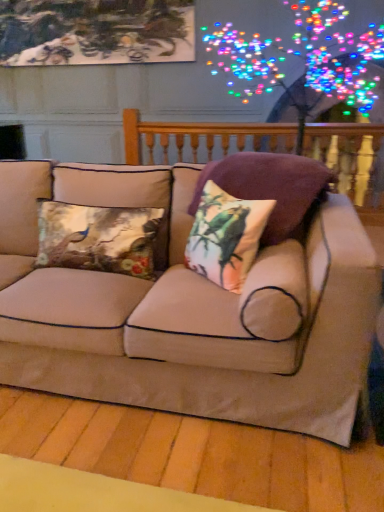
What do you see at coordinates (99, 238) in the screenshot? I see `metallic floral cushion at center left, acting as the first pillow starting from the left` at bounding box center [99, 238].

Locate an element on the screen. wooden balustrade at upper center is located at coordinates (199, 140).

Find the location of a particular element. The image size is (384, 512). velvet floral pillow at center, placed as the third pillow when sorted from left to right is located at coordinates (271, 189).

You are a GUI agent. You are given a task and a screenshot of the screen. Output one action in this format:
    pyautogui.click(x=<x>, y=<y>)
    Task: Click on the studio couch below the metallic floral cushion at center left, acting as the third pillow starting from the right (from a real-world perspective)
    The width and height of the screenshot is (384, 512).
    Given the screenshot: What is the action you would take?
    pyautogui.click(x=192, y=313)

Based on the photo, how many degrees apart are the facing directions of metallic floral cushion at center left, acting as the third pillow starting from the right, and beige fabric couch at center?

metallic floral cushion at center left, acting as the third pillow starting from the right, and beige fabric couch at center are facing 0.000838 degrees away from each other.

Which is nearer, (143, 214) or (285, 425)?

The point (285, 425) is more forward.

From the image's perspective, is metallic floral cushion at center left, acting as the third pillow starting from the right, located above or below beige fabric couch at center?

Based on their image positions, metallic floral cushion at center left, acting as the third pillow starting from the right, is located above beige fabric couch at center.

Does wooden balustrade at upper center have a greater height compared to beige fabric couch at center?

Indeed, wooden balustrade at upper center has a greater height compared to beige fabric couch at center.

From a real-world perspective, is wooden balustrade at upper center physically below beige fabric couch at center?

Incorrect, from a real-world perspective, wooden balustrade at upper center is higher than beige fabric couch at center.

Considering the points (316, 124) and (329, 393), which point is in front, point (316, 124) or point (329, 393)?

The point (329, 393) is more forward.

Does wooden balustrade at upper center have a larger size compared to beige fabric couch at center?

No, wooden balustrade at upper center is not bigger than beige fabric couch at center.

Considering the sizes of objects printed fabric cushion at center, which is the second pillow in right-to-left order, and beige fabric couch at center in the image provided, who is bigger, printed fabric cushion at center, which is the second pillow in right-to-left order, or beige fabric couch at center?

With larger size is beige fabric couch at center.

From the picture: Measure the distance between printed fabric cushion at center, which is the second pillow in right-to-left order, and beige fabric couch at center.

The distance of printed fabric cushion at center, which is the second pillow in right-to-left order, from beige fabric couch at center is 11.91 inches.

From a real-world perspective, is printed fabric cushion at center, which is the second pillow in right-to-left order, physically below beige fabric couch at center?

Incorrect, from a real-world perspective, printed fabric cushion at center, which is the second pillow in right-to-left order, is higher than beige fabric couch at center.

Is beige fabric couch at center inside printed fabric cushion at center, which is the second pillow in right-to-left order?

No, printed fabric cushion at center, which is the second pillow in right-to-left order, does not contain beige fabric couch at center.

Looking at the image, does velvet floral pillow at center, the 1th pillow when ordered from right to left, seem bigger or smaller compared to beige fabric couch at center?

In the image, velvet floral pillow at center, the 1th pillow when ordered from right to left, appears to be smaller than beige fabric couch at center.

Is point (239, 188) closer or farther from the camera than point (18, 338)?

Point (239, 188) appears to be farther away from the viewer than point (18, 338).

Between velvet floral pillow at center, the 1th pillow when ordered from right to left, and beige fabric couch at center, which one has smaller width?

With smaller width is velvet floral pillow at center, the 1th pillow when ordered from right to left.

From a real-world perspective, is velvet floral pillow at center, the 1th pillow when ordered from right to left, positioned above or below beige fabric couch at center?

Clearly, from a real-world perspective, velvet floral pillow at center, the 1th pillow when ordered from right to left, is above beige fabric couch at center.

From a real-world perspective, starting from the velvet floral pillow at center, placed as the third pillow when sorted from left to right, which pillow is the 1st one below it? Please provide its 2D coordinates.

[(226, 236)]

Could you tell me if printed fabric cushion at center, acting as the second pillow starting from the left, is turned towards velvet floral pillow at center, placed as the third pillow when sorted from left to right?

No.

Which object is further away from the camera taking this photo, printed fabric cushion at center, which is the second pillow in right-to-left order, or velvet floral pillow at center, placed as the third pillow when sorted from left to right?

velvet floral pillow at center, placed as the third pillow when sorted from left to right, is behind.

From the image's perspective, between printed fabric cushion at center, acting as the second pillow starting from the left, and velvet floral pillow at center, the 1th pillow when ordered from right to left, which one is located above?

velvet floral pillow at center, the 1th pillow when ordered from right to left, is shown above in the image.

Which point is more distant from viewer, [43,330] or [293,148]?

The point [293,148] is behind.

From a real-world perspective, is beige fabric couch at center located higher than wooden balustrade at upper center?

Actually, beige fabric couch at center is physically below wooden balustrade at upper center in the real world.

In terms of width, does beige fabric couch at center look wider or thinner when compared to wooden balustrade at upper center?

beige fabric couch at center is wider than wooden balustrade at upper center.

Can you confirm if beige fabric couch at center is positioned to the left of wooden balustrade at upper center?

Yes, beige fabric couch at center is to the left of wooden balustrade at upper center.

Which point is more distant from viewer, (35, 267) or (261, 145)?

The point (261, 145) is more distant.

Is wooden balustrade at upper center completely or partially inside metallic floral cushion at center left, acting as the third pillow starting from the right?

Definitely not — wooden balustrade at upper center is not inside metallic floral cushion at center left, acting as the third pillow starting from the right.

Looking at the image, does metallic floral cushion at center left, acting as the third pillow starting from the right, seem bigger or smaller compared to wooden balustrade at upper center?

In the image, metallic floral cushion at center left, acting as the third pillow starting from the right, appears to be smaller than wooden balustrade at upper center.

The image size is (384, 512). I want to click on studio couch lying in front of the metallic floral cushion at center left, acting as the first pillow starting from the left, so click(192, 313).

Where is `balustrade above the beige fabric couch at center (from the image's perspective)`? The width and height of the screenshot is (384, 512). balustrade above the beige fabric couch at center (from the image's perspective) is located at coordinates (199, 140).

Which object lies nearer to the anchor point printed fabric cushion at center, which is the second pillow in right-to-left order, velvet floral pillow at center, the 1th pillow when ordered from right to left, or metallic floral cushion at center left, acting as the third pillow starting from the right?

Among the two, velvet floral pillow at center, the 1th pillow when ordered from right to left, is located nearer to printed fabric cushion at center, which is the second pillow in right-to-left order.

Based on the photo, from the image, which object appears to be nearer to beige fabric couch at center, velvet floral pillow at center, the 1th pillow when ordered from right to left, or printed fabric cushion at center, acting as the second pillow starting from the left?

Based on the image, printed fabric cushion at center, acting as the second pillow starting from the left, appears to be nearer to beige fabric couch at center.

Estimate the real-world distances between objects in this image. Which object is closer to velvet floral pillow at center, the 1th pillow when ordered from right to left, beige fabric couch at center or wooden balustrade at upper center?

Among the two, beige fabric couch at center is located nearer to velvet floral pillow at center, the 1th pillow when ordered from right to left.

Based on their spatial positions, is velvet floral pillow at center, the 1th pillow when ordered from right to left, or metallic floral cushion at center left, acting as the third pillow starting from the right, closer to beige fabric couch at center?

metallic floral cushion at center left, acting as the third pillow starting from the right.

From the image, which object appears to be farther from metallic floral cushion at center left, acting as the third pillow starting from the right, wooden balustrade at upper center or beige fabric couch at center?

Based on the image, wooden balustrade at upper center appears to be further to metallic floral cushion at center left, acting as the third pillow starting from the right.

From the picture: Estimate the real-world distances between objects in this image. Which object is further from wooden balustrade at upper center, metallic floral cushion at center left, acting as the first pillow starting from the left, or velvet floral pillow at center, placed as the third pillow when sorted from left to right?

metallic floral cushion at center left, acting as the first pillow starting from the left, is positioned further to the anchor wooden balustrade at upper center.

Based on their spatial positions, is printed fabric cushion at center, which is the second pillow in right-to-left order, or wooden balustrade at upper center further from beige fabric couch at center?

wooden balustrade at upper center.

Estimate the real-world distances between objects in this image. Which object is further from wooden balustrade at upper center, beige fabric couch at center or metallic floral cushion at center left, acting as the first pillow starting from the left?

beige fabric couch at center is further to wooden balustrade at upper center.

Where is `studio couch between metallic floral cushion at center left, acting as the first pillow starting from the left, and printed fabric cushion at center, acting as the second pillow starting from the left, in the horizontal direction`? The height and width of the screenshot is (512, 384). studio couch between metallic floral cushion at center left, acting as the first pillow starting from the left, and printed fabric cushion at center, acting as the second pillow starting from the left, in the horizontal direction is located at coordinates (192, 313).

The width and height of the screenshot is (384, 512). In order to click on pillow between metallic floral cushion at center left, acting as the third pillow starting from the right, and velvet floral pillow at center, the 1th pillow when ordered from right to left, from left to right in this screenshot , I will do `click(226, 236)`.

I want to click on pillow between velvet floral pillow at center, the 1th pillow when ordered from right to left, and wooden balustrade at upper center in the front-back direction, so click(x=99, y=238).

You are a GUI agent. You are given a task and a screenshot of the screen. Output one action in this format:
    pyautogui.click(x=<x>, y=<y>)
    Task: Click on the studio couch between metallic floral cushion at center left, acting as the third pillow starting from the right, and velvet floral pillow at center, the 1th pillow when ordered from right to left
    The width and height of the screenshot is (384, 512).
    Given the screenshot: What is the action you would take?
    pyautogui.click(x=192, y=313)